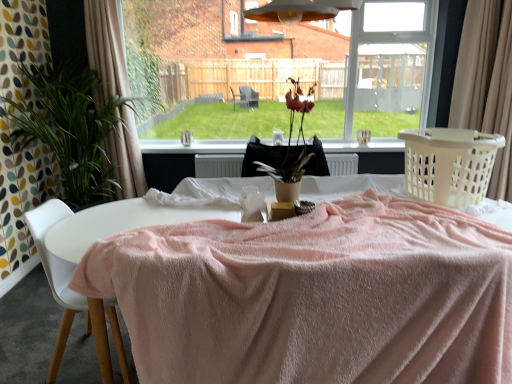
Measure the distance between point (94, 123) and camera.

Point (94, 123) and camera are 11.12 feet apart from each other.

I want to click on green leafy plant at left, so click(x=70, y=128).

The height and width of the screenshot is (384, 512). What are the coordinates of `matte brown vase at center` in the screenshot? It's located at (291, 136).

Measure the distance between point (387,1) and camera.

Point (387,1) and camera are 23.49 feet apart from each other.

In order to face white plastic chair at lower left, should I rotate leftwards or rightwards?

Turn left by 21.044 degrees to look at white plastic chair at lower left.

Consider the image. What is the approximate width of white smooth table at center?

The width of white smooth table at center is 38.77 inches.

What do you see at coordinates (151, 213) in the screenshot? I see `white smooth table at center` at bounding box center [151, 213].

Locate an element on the screen. black fabric at center is located at coordinates (194, 146).

At what (x,y) coordinates should I click in order to perform the action: click on green leafy plant at left. Please return your answer as a coordinate pair (x, y). Image resolution: width=512 pixels, height=384 pixels. Looking at the image, I should click on (70, 128).

Is matte brown vase at center aimed at beige fabric curtain at right, which is the 1th curtain from right to left?

No, matte brown vase at center is not aimed at beige fabric curtain at right, which is the 1th curtain from right to left.

Relative to beige fabric curtain at right, which ranks as the second curtain in left-to-right order, is matte brown vase at center in front or behind?

In the image, matte brown vase at center appears in front of beige fabric curtain at right, which ranks as the second curtain in left-to-right order.

From the image's perspective, is matte brown vase at center over beige fabric curtain at right, which is the 1th curtain from right to left?

No, from the image's perspective, matte brown vase at center is not above beige fabric curtain at right, which is the 1th curtain from right to left.

Is point (41, 218) farther from viewer compared to point (462, 31)?

No, it is not.

Looking at their sizes, would you say white plastic chair at lower left is wider or thinner than beige fabric curtain at right, which is the 1th curtain from right to left?

Considering their sizes, white plastic chair at lower left looks broader than beige fabric curtain at right, which is the 1th curtain from right to left.

Does white plastic chair at lower left lie in front of beige fabric curtain at right, which ranks as the second curtain in left-to-right order?

Yes, the depth of white plastic chair at lower left is less than that of beige fabric curtain at right, which ranks as the second curtain in left-to-right order.

What's the angular difference between white plastic chair at lower left and beige fabric curtain at right, which ranks as the second curtain in left-to-right order,'s facing directions?

The facing directions of white plastic chair at lower left and beige fabric curtain at right, which ranks as the second curtain in left-to-right order, are 177 degrees apart.

How many degrees apart are the facing directions of black fabric at center and green leafy plant at left?

1.04 degrees separate the facing orientations of black fabric at center and green leafy plant at left.

From a real-world perspective, is black fabric at center beneath green leafy plant at left?

Correct, in the physical world, black fabric at center is lower than green leafy plant at left.

Does black fabric at center touch green leafy plant at left?

No, black fabric at center is not making contact with green leafy plant at left.

Between point (170, 148) and point (14, 133), which one is positioned behind?

The point (170, 148) is farther.

Do you think black fabric at center is within white smooth table at center, or outside of it?

black fabric at center is spatially situated outside white smooth table at center.

Who is smaller, black fabric at center or white smooth table at center?

With smaller size is black fabric at center.

Could you tell me if black fabric at center is facing white smooth table at center?

Yes, black fabric at center is turned towards white smooth table at center.

How different are the orientations of black fabric at center and white smooth table at center in degrees?

There is a 0.279-degree angle between the facing directions of black fabric at center and white smooth table at center.

Can you tell me how much matte brown vase at center and white plastic chair at lower left differ in facing direction?

matte brown vase at center and white plastic chair at lower left are facing 89.3 degrees away from each other.

Between matte brown vase at center and white plastic chair at lower left, which one appears on the right side from the viewer's perspective?

matte brown vase at center is more to the right.

Considering the relative sizes of matte brown vase at center and white plastic chair at lower left in the image provided, is matte brown vase at center bigger than white plastic chair at lower left?

Incorrect, matte brown vase at center is not larger than white plastic chair at lower left.

Considering the sizes of objects matte brown vase at center and black fabric at center in the image provided, who is wider, matte brown vase at center or black fabric at center?

Wider between the two is black fabric at center.

In the image, is matte brown vase at center on the left side or the right side of black fabric at center?

In the image, matte brown vase at center appears on the right side of black fabric at center.

Is matte brown vase at center turned away from black fabric at center?

Yes, black fabric at center is at the back of matte brown vase at center.

Between matte brown vase at center and black fabric at center, which one has less height?

With less height is black fabric at center.

At what (x,y) coordinates should I click in order to perform the action: click on window sill behind the beige fabric curtain at left, placed as the first curtain when sorted from left to right. Please return your answer as a coordinate pair (x, y). This screenshot has width=512, height=384. Looking at the image, I should click on (194, 146).

From a real-world perspective, is black fabric at center below beige fabric curtain at left, placed as the first curtain when sorted from left to right?

Yes, from a real-world perspective, black fabric at center is under beige fabric curtain at left, placed as the first curtain when sorted from left to right.

From the image's perspective, is black fabric at center positioned above or below beige fabric curtain at left, the second curtain when ordered from right to left?

From the image's perspective, black fabric at center appears below beige fabric curtain at left, the second curtain when ordered from right to left.

Is point (284, 141) positioned before point (95, 4)?

Yes, it is in front of point (95, 4).

Identify the location of floral arrangement below the beige fabric curtain at right, which ranks as the second curtain in left-to-right order (from a real-world perspective). Image resolution: width=512 pixels, height=384 pixels. pos(291,136).

Where is `the 1st curtain above when counting from the white plastic chair at lower left (from the image's perspective)`? The height and width of the screenshot is (384, 512). the 1st curtain above when counting from the white plastic chair at lower left (from the image's perspective) is located at coordinates (486, 83).

Estimate the real-world distances between objects in this image. Which object is closer to matte brown vase at center, green leafy plant at left or beige fabric curtain at right, which is the 1th curtain from right to left?

green leafy plant at left.

When comparing their distances from transparent glass window at center, does beige fabric curtain at right, which ranks as the second curtain in left-to-right order, or green leafy plant at left seem closer?

green leafy plant at left is closer to transparent glass window at center.

Based on their spatial positions, is white plastic chair at lower left or white plastic laundry basket at upper right further from white smooth table at center?

Based on the image, white plastic laundry basket at upper right appears to be further to white smooth table at center.

Looking at the image, which one is located closer to transparent glass window at center, white plastic laundry basket at upper right or beige fabric curtain at right, which ranks as the second curtain in left-to-right order?

Among the two, beige fabric curtain at right, which ranks as the second curtain in left-to-right order, is located nearer to transparent glass window at center.

Estimate the real-world distances between objects in this image. Which object is further from beige fabric curtain at right, which is the 1th curtain from right to left, white smooth table at center or matte brown vase at center?

The object further to beige fabric curtain at right, which is the 1th curtain from right to left, is matte brown vase at center.

From the picture: Looking at the image, which one is located closer to white plastic chair at lower left, beige fabric curtain at right, which is the 1th curtain from right to left, or black fabric at center?

Result: black fabric at center.

From the image, which object appears to be farther from black fabric at center, white smooth table at center or white plastic laundry basket at upper right?

white plastic laundry basket at upper right is further to black fabric at center.

When comparing their distances from white plastic chair at lower left, does transparent glass window at center or white plastic laundry basket at upper right seem closer?

white plastic laundry basket at upper right is closer to white plastic chair at lower left.

In order to click on table between white plastic chair at lower left and white plastic laundry basket at upper right in the horizontal direction in this screenshot , I will do `click(151, 213)`.

The width and height of the screenshot is (512, 384). In order to click on floral arrangement situated between beige fabric curtain at left, the second curtain when ordered from right to left, and white plastic laundry basket at upper right from left to right in this screenshot , I will do `click(291, 136)`.

The width and height of the screenshot is (512, 384). I want to click on laundry basket located between black fabric at center and beige fabric curtain at right, which is the 1th curtain from right to left, in the left-right direction, so click(449, 164).

Identify the location of window sill between green leafy plant at left and white plastic laundry basket at upper right. Image resolution: width=512 pixels, height=384 pixels. (194, 146).